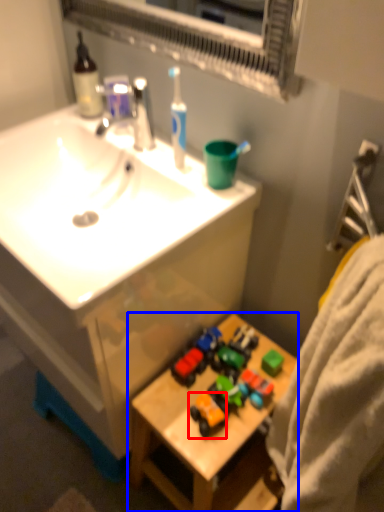
Question: Which object appears closest to the camera in this image, toy (highlighted by a red box) or table (highlighted by a blue box)?

Choices:
 (A) toy
 (B) table

Answer: (B)